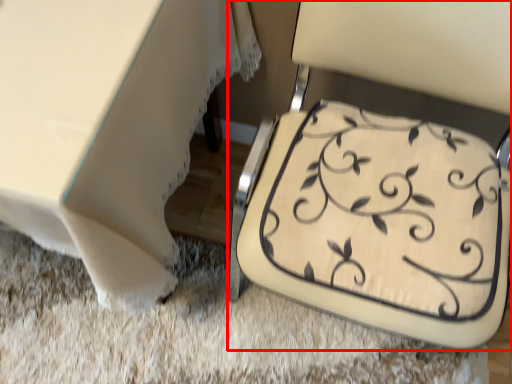
Question: In this image, where is chair (annotated by the red box) located relative to table?

Choices:
 (A) right
 (B) left

Answer: (A)